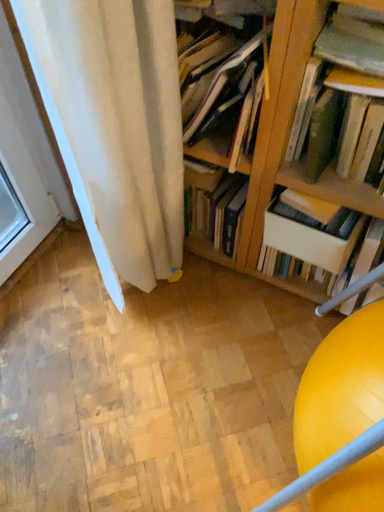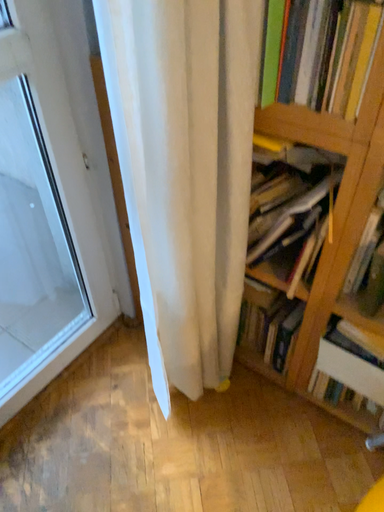
Question: How did the camera likely rotate when shooting the video?

Choices:
 (A) rotated upward
 (B) rotated downward

Answer: (A)